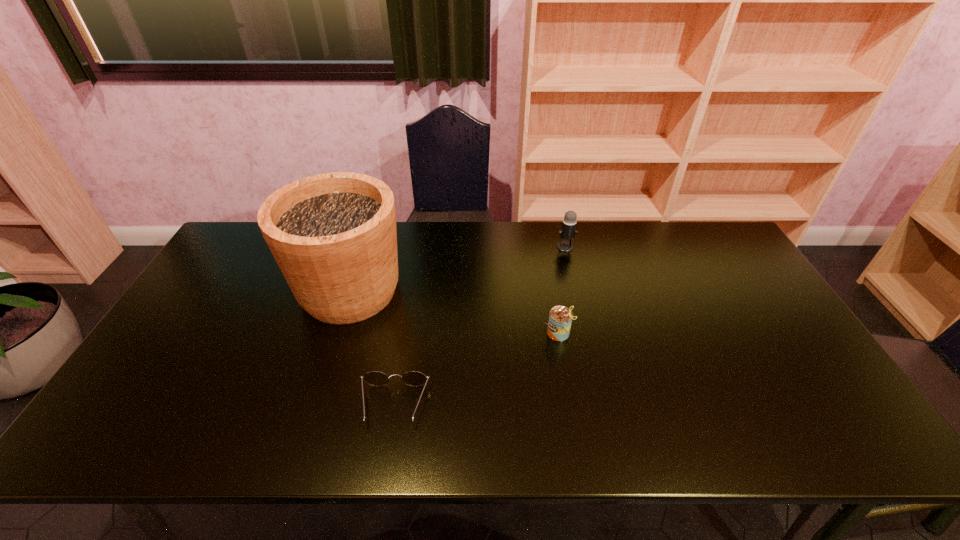
Where is `flowerpot that is at the far edge`? Image resolution: width=960 pixels, height=540 pixels. flowerpot that is at the far edge is located at coordinates (333, 235).

This screenshot has width=960, height=540. In order to click on microphone that is at the far edge in this screenshot , I will do `click(568, 231)`.

Identify the location of object that is at the near edge. Image resolution: width=960 pixels, height=540 pixels. (375, 378).

Identify the location of free space at the far edge of the desktop. (520, 260).

In the image, there is a desktop. At what (x,y) coordinates should I click in order to perform the action: click on free space at the near edge. Please return your answer as a coordinate pair (x, y). Image resolution: width=960 pixels, height=540 pixels. Looking at the image, I should click on (429, 422).

What are the coordinates of `free location at the left edge` in the screenshot? It's located at (239, 282).

Identify the location of free spot at the far left corner of the desktop. The width and height of the screenshot is (960, 540). (248, 244).

What are the coordinates of `vacant space at the near left corner of the desktop` in the screenshot? It's located at (115, 426).

This screenshot has width=960, height=540. Find the location of `vacant space at the near right corner of the desktop`. vacant space at the near right corner of the desktop is located at coordinates (x=854, y=424).

Find the location of a particular element. free space between the flowerpot and the nearest object is located at coordinates (372, 348).